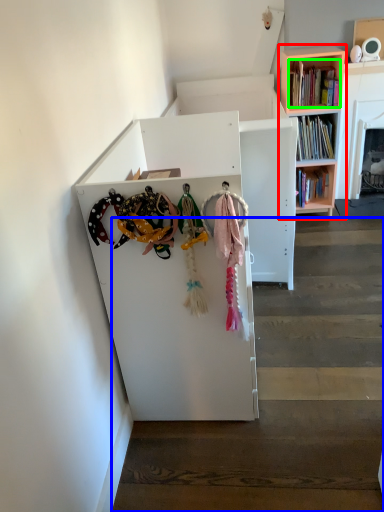
Question: Based on their relative distances, which object is nearer to bookcase (highlighted by a red box)? Choose from stairwell (highlighted by a blue box) and book (highlighted by a green box).

Choices:
 (A) stairwell
 (B) book

Answer: (B)